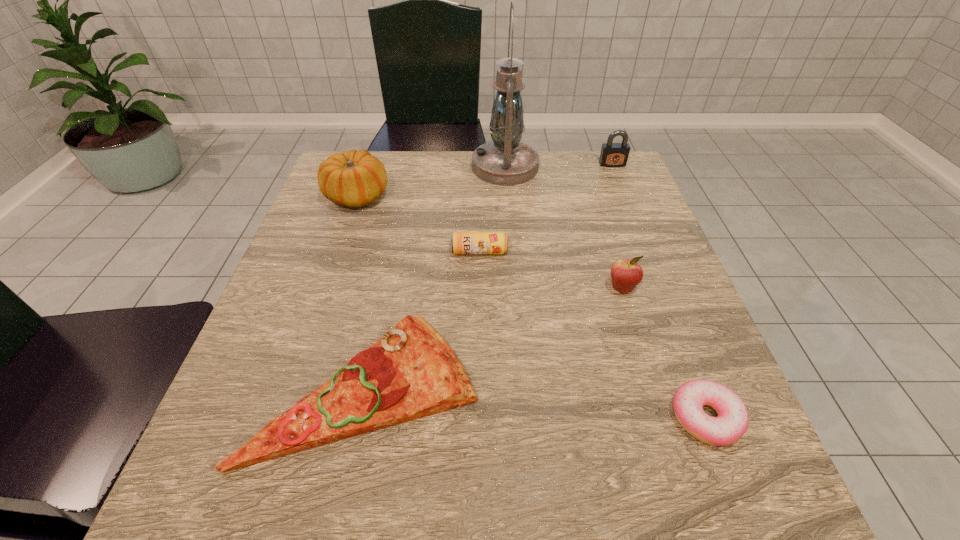
The height and width of the screenshot is (540, 960). In order to click on padlock present at the right edge in this screenshot , I will do `click(612, 154)`.

This screenshot has width=960, height=540. In order to click on apple that is at the right edge in this screenshot , I will do `click(626, 274)`.

Where is `doughnut that is at the right edge`? doughnut that is at the right edge is located at coordinates (729, 426).

Find the location of a particular element. object located at the far left corner is located at coordinates (354, 178).

This screenshot has height=540, width=960. In order to click on object that is at the near left corner in this screenshot , I will do `click(411, 372)`.

This screenshot has width=960, height=540. What are the coordinates of `object at the far right corner` in the screenshot? It's located at (612, 154).

This screenshot has width=960, height=540. Find the location of `free location at the far edge`. free location at the far edge is located at coordinates (525, 189).

Identify the location of free space at the near edge of the desktop. The width and height of the screenshot is (960, 540). (564, 492).

Identify the location of vacant point at the left edge. The image size is (960, 540). (309, 229).

The width and height of the screenshot is (960, 540). What are the coordinates of `blank space at the right edge of the desktop` in the screenshot? It's located at (686, 373).